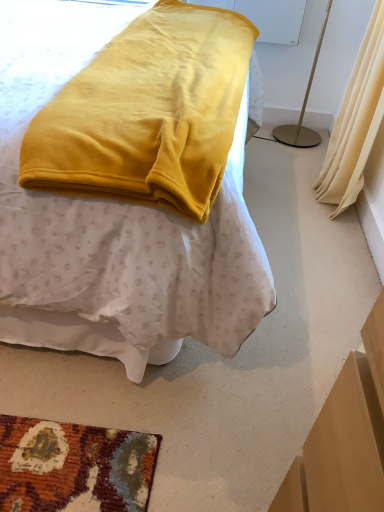
Question: From a real-world perspective, is white plastic lampshade at upper right positioned above or below beige fabric curtain at right?

Choices:
 (A) above
 (B) below

Answer: (A)

Question: In terms of width, does white plastic lampshade at upper right look wider or thinner when compared to beige fabric curtain at right?

Choices:
 (A) wide
 (B) thin

Answer: (A)

Question: Estimate the real-world distances between objects in this image. Which object is farther from the beige fabric curtain at right?

Choices:
 (A) white plastic lampshade at upper right
 (B) velvet yellow blanket at center

Answer: (B)

Question: Based on their relative distances, which object is farther from the white plastic lampshade at upper right?

Choices:
 (A) beige fabric curtain at right
 (B) velvet yellow blanket at center

Answer: (B)